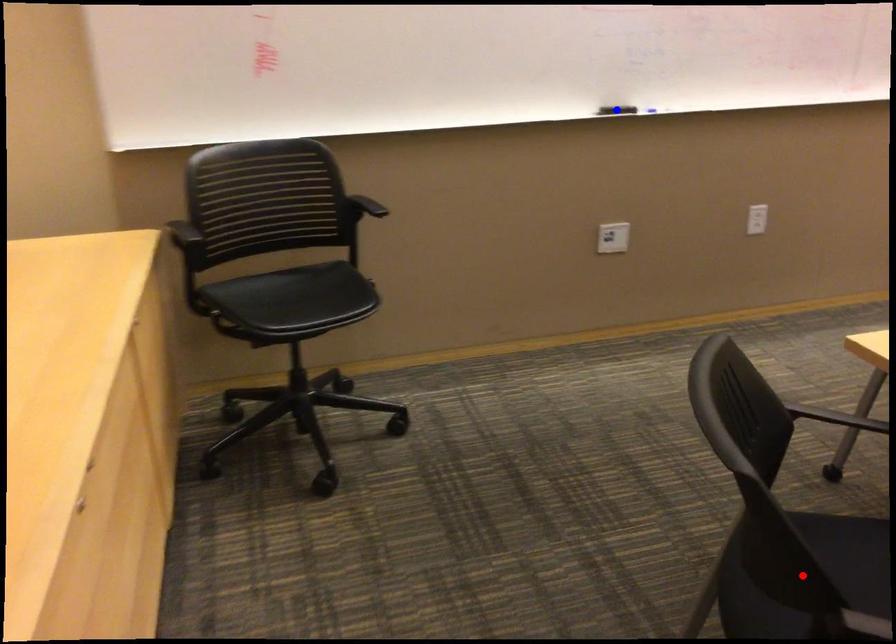
Question: In the image, two points are highlighted. Which point is nearer to the camera? Reply with the corresponding letter.

Choices:
 (A) blue point
 (B) red point

Answer: (B)